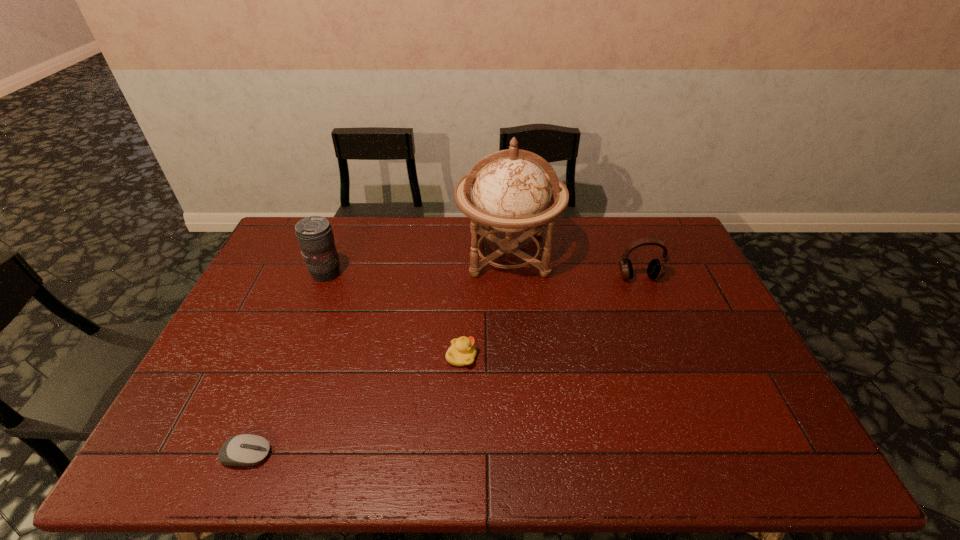
In order to click on vacant space located on the ear pads of the rightmost object in this screenshot , I will do `click(648, 300)`.

Image resolution: width=960 pixels, height=540 pixels. What are the coordinates of `vacant space located on the beak of the fourth farthest object` in the screenshot? It's located at (502, 357).

You are a GUI agent. You are given a task and a screenshot of the screen. Output one action in this format:
    pyautogui.click(x=<x>, y=<y>)
    Task: Click on the vacant space situated on the wheel side of the computer equipment
    
    Given the screenshot: What is the action you would take?
    pyautogui.click(x=327, y=455)

Locate an element on the screen. object that is at the far edge is located at coordinates (511, 193).

I want to click on object located at the near edge, so click(x=245, y=449).

Locate an element on the screen. object that is at the left edge is located at coordinates (245, 449).

Where is `object positioned at the right edge`? The height and width of the screenshot is (540, 960). object positioned at the right edge is located at coordinates (656, 269).

Locate an element on the screen. object that is at the near left corner is located at coordinates (245, 449).

You are a GUI agent. You are given a task and a screenshot of the screen. Output one action in this format:
    pyautogui.click(x=<x>, y=<y>)
    Task: Click on the vacant space at the far edge of the desktop
    The width and height of the screenshot is (960, 540).
    Given the screenshot: What is the action you would take?
    pyautogui.click(x=405, y=241)

The width and height of the screenshot is (960, 540). Find the location of `free space at the near edge of the desktop`. free space at the near edge of the desktop is located at coordinates (494, 457).